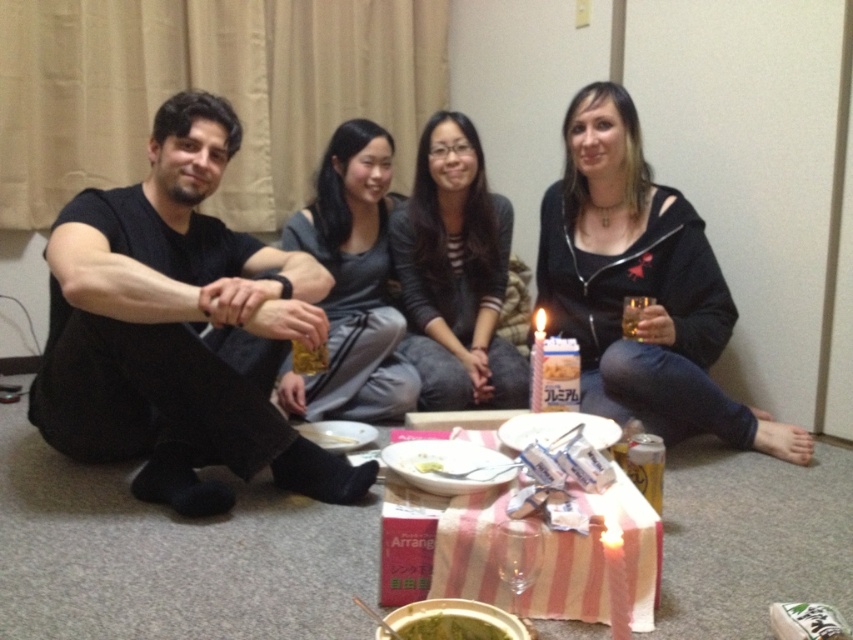
Question: Is black matte shirt at left closer to the viewer compared to smooth white cake at center?

Choices:
 (A) no
 (B) yes

Answer: (B)

Question: Can you confirm if gray matte shirt at center is wider than green matte rice at center?

Choices:
 (A) yes
 (B) no

Answer: (A)

Question: Which object is positioned closest to the gray matte shirt at center?

Choices:
 (A) black matte shirt at left
 (B) black hoodie at center

Answer: (A)

Question: Is black hoodie at center further to camera compared to green matte rice at center?

Choices:
 (A) yes
 (B) no

Answer: (A)

Question: Which of the following is the farthest from the observer?

Choices:
 (A) green matte rice at center
 (B) smooth white cake at center
 (C) translucent glass at center
 (D) translucent glass beverage at lower center

Answer: (C)

Question: Based on their relative distances, which object is nearer to the black hoodie at center?

Choices:
 (A) translucent glass beverage at lower center
 (B) translucent glass at center
 (C) gray matte shirt at center

Answer: (B)